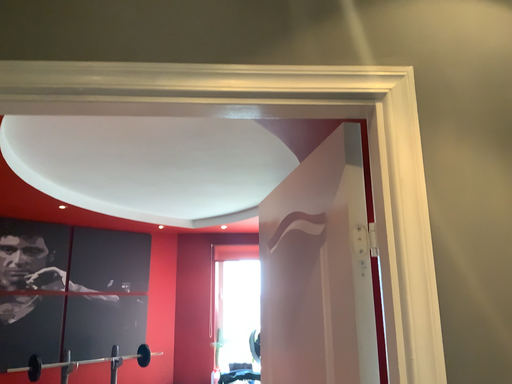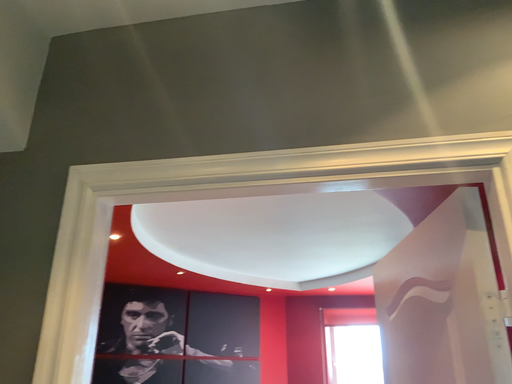
Question: How did the camera likely rotate when shooting the video?

Choices:
 (A) rotated right
 (B) rotated left

Answer: (B)